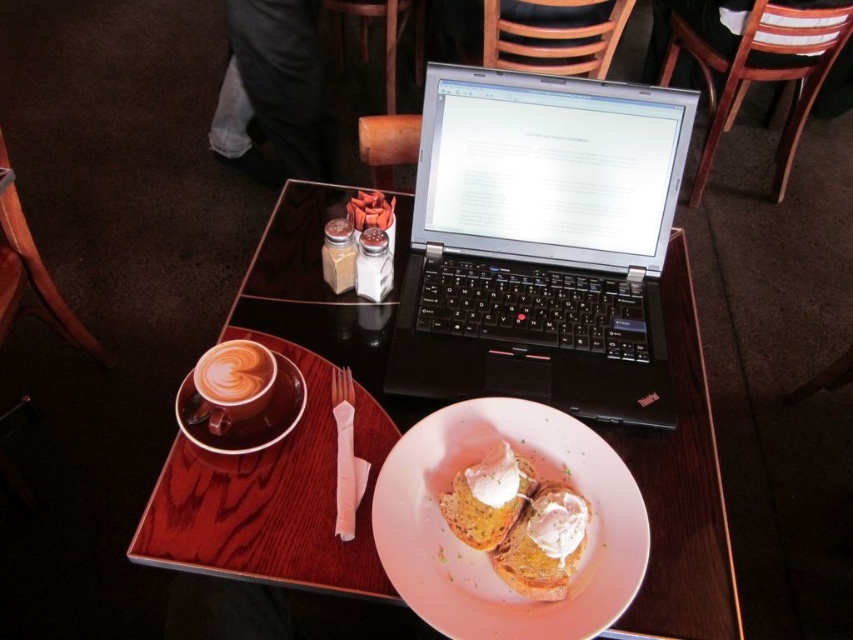
Is point (433, 592) positioned before point (293, 424)?

Yes, it is.

Between pink matte plate at center and matte ceramic saucer at upper left, which one has less height?

Standing shorter between the two is matte ceramic saucer at upper left.

Does point (447, 589) come farther from viewer compared to point (219, 451)?

No, (447, 589) is in front of (219, 451).

Locate an element on the screen. The image size is (853, 640). pink matte plate at center is located at coordinates click(x=486, y=552).

In the scene shown: Is pink matte plate at center taller than white fluffy poached egg on toasted bread at center?

Correct, pink matte plate at center is much taller as white fluffy poached egg on toasted bread at center.

Does pink matte plate at center appear over white fluffy poached egg on toasted bread at center?

Actually, pink matte plate at center is below white fluffy poached egg on toasted bread at center.

Who is more distant from viewer, (451, 604) or (492, 547)?

Positioned behind is point (492, 547).

Locate an element on the screen. pink matte plate at center is located at coordinates point(486,552).

Does black plastic laptop at center appear on the right side of latte art at center?

Correct, you'll find black plastic laptop at center to the right of latte art at center.

Based on the photo, is black plastic laptop at center positioned at the back of latte art at center?

Yes, black plastic laptop at center is further from the viewer.

Where is `black plastic laptop at center`? This screenshot has width=853, height=640. black plastic laptop at center is located at coordinates (541, 243).